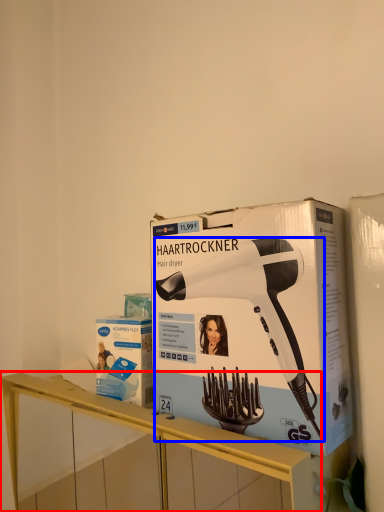
Question: Which point is closer to the camera, furniture (highlighted by a red box) or hair drier (highlighted by a blue box)?

Choices:
 (A) furniture
 (B) hair drier

Answer: (A)